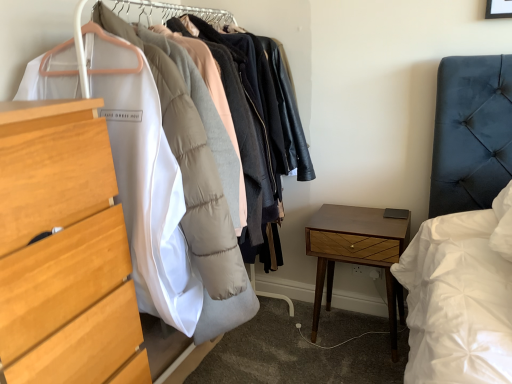
This screenshot has width=512, height=384. What do you see at coordinates (357, 253) in the screenshot?
I see `wooden nightstand at lower right` at bounding box center [357, 253].

What is the approximate width of wooden nightstand at lower right?

wooden nightstand at lower right is 13.06 inches in width.

What is the approximate height of wooden nightstand at lower right?

The height of wooden nightstand at lower right is 23.41 inches.

Locate an element on the screen. The width and height of the screenshot is (512, 384). wooden nightstand at lower right is located at coordinates (357, 253).

Measure the distance between point [323,212] and camera.

The distance of point [323,212] from camera is 1.94 meters.

The height and width of the screenshot is (384, 512). I want to click on light wood chest of drawers at left, so click(x=64, y=251).

Image resolution: width=512 pixels, height=384 pixels. What do you see at coordinates (64, 251) in the screenshot?
I see `light wood chest of drawers at left` at bounding box center [64, 251].

What is the approximate width of light wood chest of drawers at left?

light wood chest of drawers at left is 20.28 inches in width.

Identify the location of wooden nightstand at lower right. This screenshot has height=384, width=512. (357, 253).

Which is more to the right, light wood chest of drawers at left or wooden nightstand at lower right?

wooden nightstand at lower right is more to the right.

Between light wood chest of drawers at left and wooden nightstand at lower right, which one is positioned behind?

wooden nightstand at lower right is behind.

Is point (126, 258) positioned in front of point (372, 217)?

That is True.

Consider the image. From the image's perspective, which is below, light wood chest of drawers at left or wooden nightstand at lower right?

wooden nightstand at lower right.

From a real-world perspective, who is located lower, light wood chest of drawers at left or wooden nightstand at lower right?

In real-world perspective, wooden nightstand at lower right is lower.

Is light wood chest of drawers at left wider or thinner than wooden nightstand at lower right?

In the image, light wood chest of drawers at left appears to be wider than wooden nightstand at lower right.

Does light wood chest of drawers at left have a lesser height compared to wooden nightstand at lower right?

No.

Between light wood chest of drawers at left and wooden nightstand at lower right, which one has larger size?

light wood chest of drawers at left is bigger.

Is light wood chest of drawers at left outside of wooden nightstand at lower right?

Indeed, light wood chest of drawers at left is completely outside wooden nightstand at lower right.

Is light wood chest of drawers at left positioned far away from wooden nightstand at lower right?

Absolutely, light wood chest of drawers at left is distant from wooden nightstand at lower right.

Is light wood chest of drawers at left oriented towards wooden nightstand at lower right?

No, light wood chest of drawers at left does not turn towards wooden nightstand at lower right.

Where is `chest of drawers above the wooden nightstand at lower right (from a real-world perspective)`? The image size is (512, 384). chest of drawers above the wooden nightstand at lower right (from a real-world perspective) is located at coordinates (64, 251).

Does wooden nightstand at lower right appear on the left side of light wood chest of drawers at left?

No.

Is the depth of wooden nightstand at lower right greater than that of light wood chest of drawers at left?

Yes, it is.

Considering the positions of point (353, 225) and point (17, 138), is point (353, 225) closer or farther from the camera than point (17, 138)?

Point (353, 225).

From the image's perspective, which one is positioned higher, wooden nightstand at lower right or light wood chest of drawers at left?

light wood chest of drawers at left appears higher in the image.

From a real-world perspective, which is physically above, wooden nightstand at lower right or light wood chest of drawers at left?

light wood chest of drawers at left.

Between wooden nightstand at lower right and light wood chest of drawers at left, which one has smaller width?

wooden nightstand at lower right.

From their relative heights in the image, would you say wooden nightstand at lower right is taller or shorter than light wood chest of drawers at left?

Considering their sizes, wooden nightstand at lower right has less height than light wood chest of drawers at left.

Considering the relative sizes of wooden nightstand at lower right and light wood chest of drawers at left in the image provided, is wooden nightstand at lower right smaller than light wood chest of drawers at left?

Indeed, wooden nightstand at lower right has a smaller size compared to light wood chest of drawers at left.

Does wooden nightstand at lower right contain light wood chest of drawers at left?

Definitely not — light wood chest of drawers at left is not inside wooden nightstand at lower right.

Is wooden nightstand at lower right not near light wood chest of drawers at left?

Indeed, wooden nightstand at lower right is not near light wood chest of drawers at left.

Is wooden nightstand at lower right turned away from light wood chest of drawers at left?

No, wooden nightstand at lower right is not facing the opposite direction of light wood chest of drawers at left.

Can you tell me how much wooden nightstand at lower right and light wood chest of drawers at left differ in facing direction?

wooden nightstand at lower right and light wood chest of drawers at left are facing 91.7 degrees away from each other.

Consider the image. How far apart are wooden nightstand at lower right and light wood chest of drawers at left?

A distance of 1.08 meters exists between wooden nightstand at lower right and light wood chest of drawers at left.

Locate an element on the screen. The height and width of the screenshot is (384, 512). nightstand below the light wood chest of drawers at left (from a real-world perspective) is located at coordinates (357, 253).

Locate an element on the screen. The height and width of the screenshot is (384, 512). nightstand below the light wood chest of drawers at left (from the image's perspective) is located at coordinates (357, 253).

This screenshot has width=512, height=384. Find the location of `chest of drawers in front of the wooden nightstand at lower right`. chest of drawers in front of the wooden nightstand at lower right is located at coordinates (64, 251).